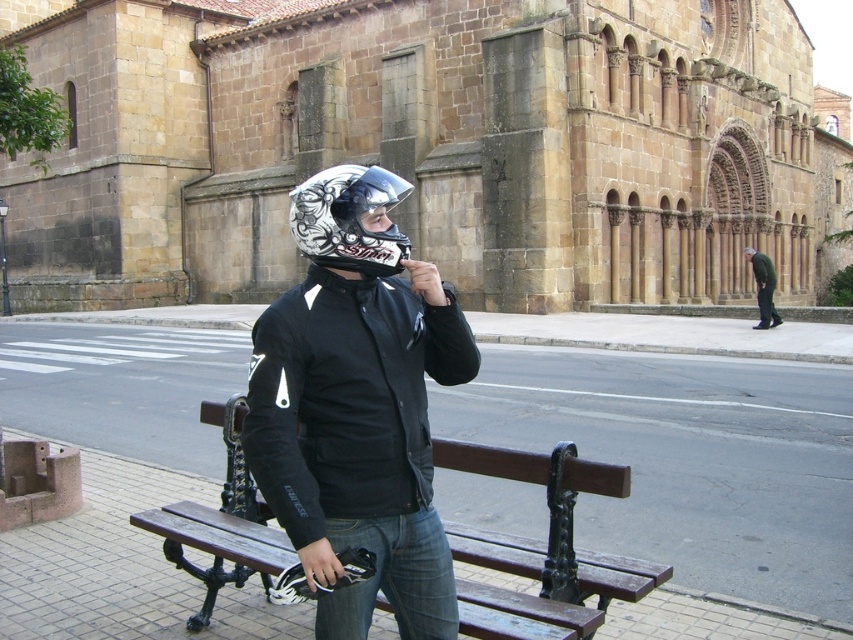
Question: Does matte black helmet at center appear over transparent plastic goggles at center?

Choices:
 (A) no
 (B) yes

Answer: (A)

Question: Can you confirm if matte black helmet at center is positioned below transparent plastic goggles at center?

Choices:
 (A) yes
 (B) no

Answer: (A)

Question: Which point is farther to the camera?

Choices:
 (A) (427, 305)
 (B) (770, 266)

Answer: (B)

Question: Among these objects, which one is nearest to the camera?

Choices:
 (A) glossy black helmet at center
 (B) brown wooden bench at center

Answer: (A)

Question: Does matte black helmet at center have a larger size compared to transparent plastic goggles at center?

Choices:
 (A) yes
 (B) no

Answer: (B)

Question: Which point is farther to the camera?

Choices:
 (A) (373, 196)
 (B) (352, 211)
 (C) (567, 524)
 (D) (427, 560)

Answer: (C)